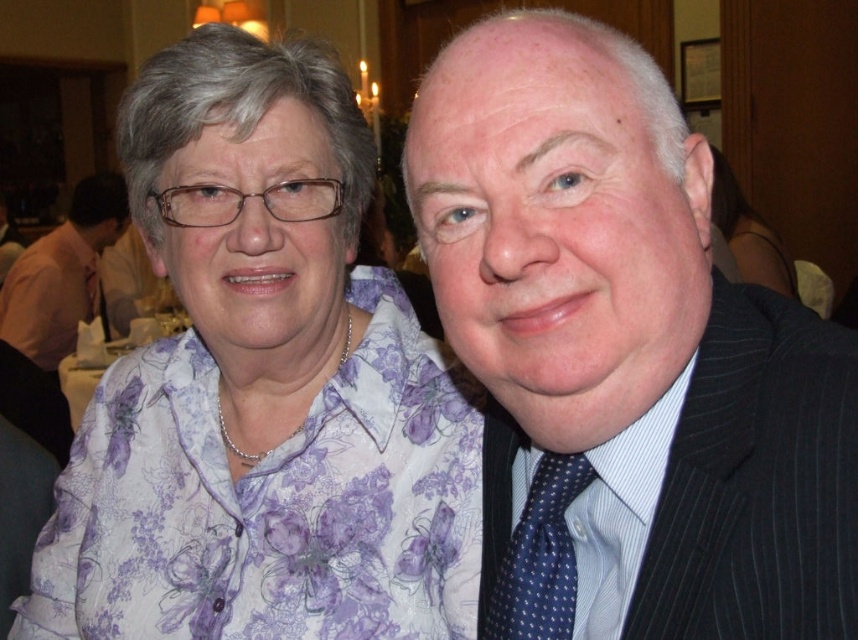
Question: Does matte purple shirt at center come behind purple floral blouse at upper left?

Choices:
 (A) no
 (B) yes

Answer: (B)

Question: Can you confirm if purple floral shirt at left is positioned below purple floral blouse at upper left?

Choices:
 (A) yes
 (B) no

Answer: (A)

Question: Which point is closer to the camera?

Choices:
 (A) purple floral shirt at left
 (B) pinstriped suit at right

Answer: (B)

Question: Which object is positioned closest to the purple floral blouse at upper left?

Choices:
 (A) dark blue pinstripe suit at right
 (B) pinstriped suit at right

Answer: (B)

Question: Can you confirm if purple floral shirt at left is positioned to the right of dark blue pinstripe suit at right?

Choices:
 (A) yes
 (B) no

Answer: (B)

Question: Which point is farther to the camera?

Choices:
 (A) blue dotted tie at right
 (B) purple floral blouse at upper left
 (C) dark blue pinstripe suit at right

Answer: (B)